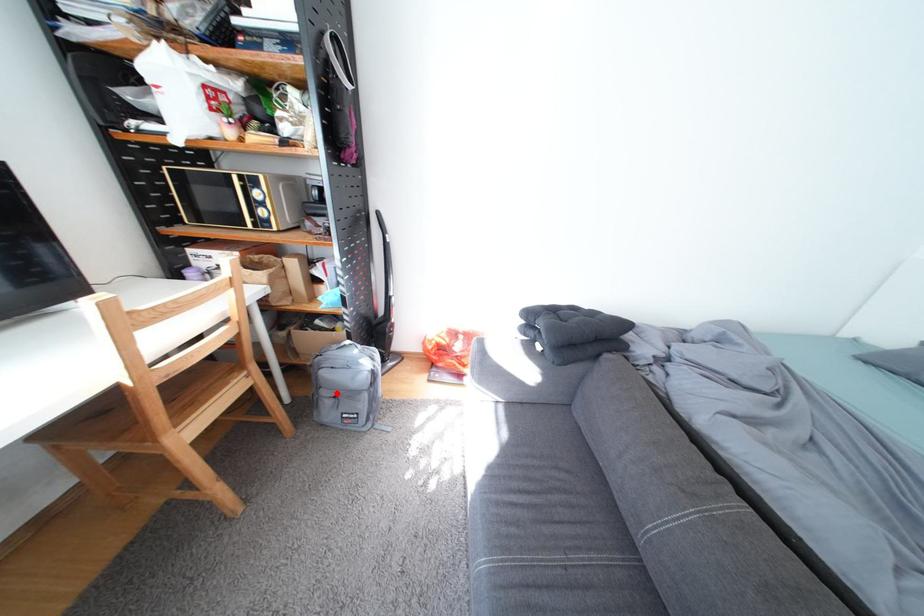
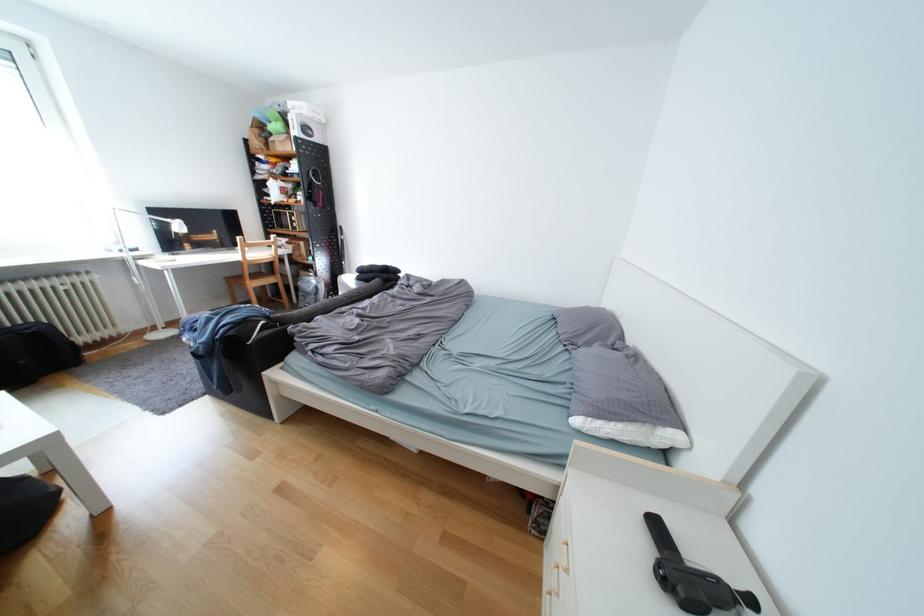
Question: I am providing you with two images of the same scene from different viewpoints. Image1 has a red point marked. In image2, the corresponding 3D location appears at what relative position? Reply with the corresponding letter.

Choices:
 (A) Closer
 (B) Farther

Answer: (B)